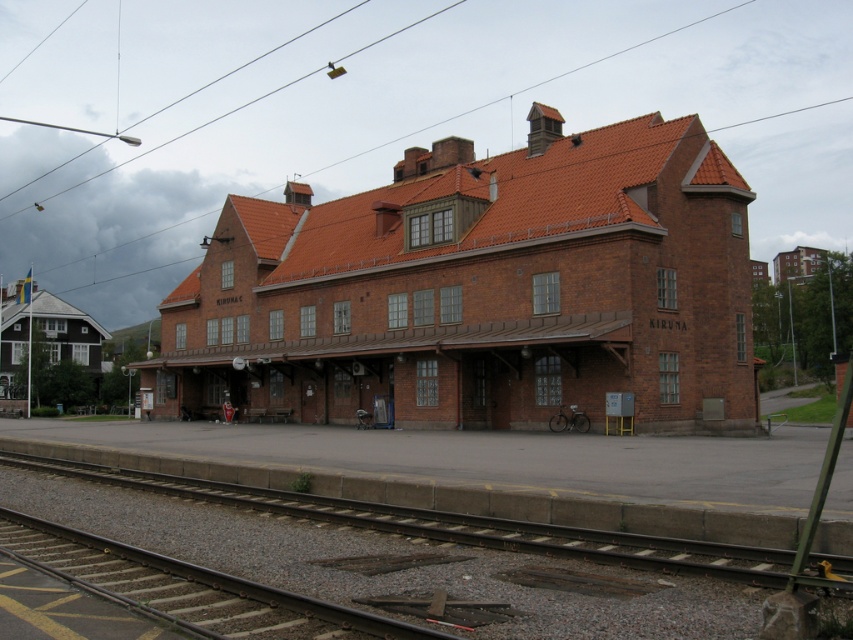
Can you confirm if smooth metal tracks at center is bigger than dark gray metal train track at lower left?

Indeed, smooth metal tracks at center has a larger size compared to dark gray metal train track at lower left.

Does point (281, 579) come farther from viewer compared to point (212, 604)?

That is True.

At what (x,y) coordinates should I click in order to perform the action: click on smooth metal tracks at center. Please return your answer as a coordinate pair (x, y). The height and width of the screenshot is (640, 853). Looking at the image, I should click on (397, 547).

Which of these two, brick building at center or dark gray metal train track at lower left, stands taller?

With more height is brick building at center.

Is brick building at center wider than dark gray metal train track at lower left?

Yes.

The image size is (853, 640). I want to click on brick building at center, so click(480, 289).

Is the position of brick building at center less distant than that of smooth metal tracks at center?

No.

Is brick building at center shorter than smooth metal tracks at center?

No.

Find the location of a particular element. Image resolution: width=853 pixels, height=640 pixels. brick building at center is located at coordinates [x=480, y=289].